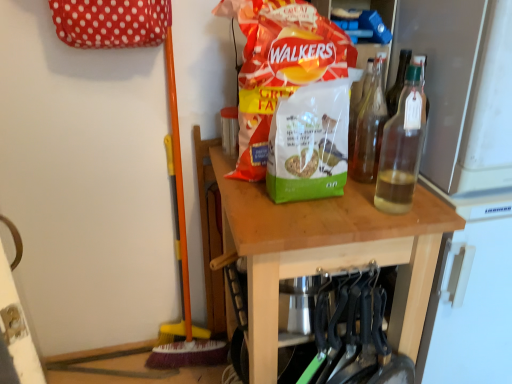
Question: Which direction should I rotate to look at matte plastic bag of walkers crisps at center, the second waste positioned from the bottom?

Choices:
 (A) left
 (B) right

Answer: (B)

Question: Is matte plastic bag of walkers crisps at center, arranged as the first waste when viewed from the top, bigger than clear glass bottle at upper right, which is counted as the second bottle, starting from the back?

Choices:
 (A) yes
 (B) no

Answer: (A)

Question: Is clear glass bottle at upper right, which is the first bottle in front-to-back order, at the back of matte plastic bag of walkers crisps at center, arranged as the first waste when viewed from the top?

Choices:
 (A) no
 (B) yes

Answer: (A)

Question: From the image's perspective, is matte plastic bag of walkers crisps at center, arranged as the first waste when viewed from the top, located beneath clear glass bottle at upper right, which is counted as the second bottle, starting from the back?

Choices:
 (A) no
 (B) yes

Answer: (A)

Question: Is the position of matte plastic bag of walkers crisps at center, the second waste positioned from the bottom, less distant than that of clear glass bottle at upper right, which is the first bottle in front-to-back order?

Choices:
 (A) no
 (B) yes

Answer: (A)

Question: Is matte plastic bag of walkers crisps at center, arranged as the first waste when viewed from the top, smaller than clear glass bottle at upper right, which is counted as the second bottle, starting from the back?

Choices:
 (A) no
 (B) yes

Answer: (A)

Question: Can you confirm if matte plastic bag of walkers crisps at center, arranged as the first waste when viewed from the top, is wider than clear glass bottle at upper right, which is counted as the second bottle, starting from the back?

Choices:
 (A) no
 (B) yes

Answer: (B)

Question: Is clear glass bottle at upper right, which is counted as the second bottle, starting from the back, turned away from wooden table at center?

Choices:
 (A) no
 (B) yes

Answer: (A)

Question: From a real-world perspective, is clear glass bottle at upper right, which is the first bottle in front-to-back order, physically above wooden table at center?

Choices:
 (A) no
 (B) yes

Answer: (B)

Question: Is clear glass bottle at upper right, which is the first bottle in front-to-back order, in front of wooden table at center?

Choices:
 (A) yes
 (B) no

Answer: (A)

Question: Would you say wooden table at center is part of clear glass bottle at upper right, which is the first bottle in front-to-back order,'s contents?

Choices:
 (A) yes
 (B) no

Answer: (B)

Question: From the image's perspective, is clear glass bottle at upper right, which is counted as the second bottle, starting from the back, under wooden table at center?

Choices:
 (A) yes
 (B) no

Answer: (B)

Question: Considering the relative sizes of clear glass bottle at upper right, which is the first bottle in front-to-back order, and wooden table at center in the image provided, is clear glass bottle at upper right, which is the first bottle in front-to-back order, shorter than wooden table at center?

Choices:
 (A) yes
 (B) no

Answer: (A)

Question: Does green matte birdseed bag at center, which is the second waste in top-to-bottom order, have a smaller size compared to matte plastic bag of walkers crisps at center, the second waste positioned from the bottom?

Choices:
 (A) yes
 (B) no

Answer: (A)